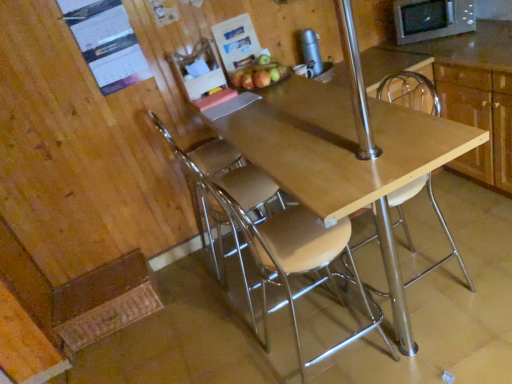
Locate an element on the screen. wooden cabinet at upper right is located at coordinates (477, 95).

How much space does metallic silver chair at center, the first chair when ordered from left to right, occupy horizontally?

19.93 inches.

What do you see at coordinates (206, 175) in the screenshot? I see `metallic silver chair at center, the third chair from the right` at bounding box center [206, 175].

Locate an element on the screen. wooden seat at center, which appears as the 2th chair when viewed from the right is located at coordinates (269, 234).

Describe the element at coordinates (269, 234) in the screenshot. I see `wooden seat at center, which appears as the 2th chair when viewed from the right` at that location.

This screenshot has width=512, height=384. What do you see at coordinates (410, 92) in the screenshot?
I see `light brown wood chair at center, which appears as the 1th chair when viewed from the right` at bounding box center [410, 92].

The height and width of the screenshot is (384, 512). What do you see at coordinates (432, 19) in the screenshot? I see `metallic silver microwave at upper right` at bounding box center [432, 19].

You are a GUI agent. You are given a task and a screenshot of the screen. Output one action in this format:
    pyautogui.click(x=<x>, y=<y>)
    Task: Click on the wooden cabinet at upper right
    This screenshot has width=512, height=384.
    Given the screenshot: What is the action you would take?
    pyautogui.click(x=477, y=95)

Is metallic silver chair at center, the first chair when ordered from left to right, in contact with metallic silver microwave at upper right?

No, metallic silver chair at center, the first chair when ordered from left to right, is not in contact with metallic silver microwave at upper right.

Can you tell me how much metallic silver chair at center, the first chair when ordered from left to right, and metallic silver microwave at upper right differ in facing direction?

132 degrees.

Can you confirm if metallic silver chair at center, the first chair when ordered from left to right, is positioned to the left of metallic silver microwave at upper right?

Yes.

Between metallic silver chair at center, the third chair from the right, and metallic silver microwave at upper right, which one has less height?

metallic silver microwave at upper right is shorter.

How different are the orientations of metallic silver chair at center, the first chair when ordered from left to right, and wooden seat at center, which appears as the 2th chair when viewed from the right, in degrees?

1.55 degrees separate the facing orientations of metallic silver chair at center, the first chair when ordered from left to right, and wooden seat at center, which appears as the 2th chair when viewed from the right.

Is metallic silver chair at center, the third chair from the right, bigger or smaller than wooden seat at center, which appears as the 2th chair when viewed from the right?

Clearly, metallic silver chair at center, the third chair from the right, is larger in size than wooden seat at center, which appears as the 2th chair when viewed from the right.

Which object is further away from the camera taking this photo, metallic silver chair at center, the third chair from the right, or wooden seat at center, which appears as the 2th chair when viewed from the right?

metallic silver chair at center, the third chair from the right.

Which of these two, metallic silver chair at center, the third chair from the right, or wooden seat at center, which appears as the 2th chair when viewed from the right, stands taller?

wooden seat at center, which appears as the 2th chair when viewed from the right.

Which object is closer to the camera taking this photo, shiny red apple at upper center or wooden seat at center, which appears as the 2th chair when viewed from the right?

wooden seat at center, which appears as the 2th chair when viewed from the right, is closer to the camera.

Considering the positions of objects shiny red apple at upper center and wooden seat at center, which is the 2th chair from left to right, in the image provided, who is more to the left, shiny red apple at upper center or wooden seat at center, which is the 2th chair from left to right,?

shiny red apple at upper center is more to the left.

Is shiny red apple at upper center taller than wooden seat at center, which is the 2th chair from left to right?

No, shiny red apple at upper center is not taller than wooden seat at center, which is the 2th chair from left to right.

Could you tell me if shiny red apple at upper center is turned towards wooden seat at center, which is the 2th chair from left to right?

No.

From the image's perspective, is metallic silver microwave at upper right above or below metallic silver chair at center, the third chair from the right?

From the image's perspective, metallic silver microwave at upper right appears above metallic silver chair at center, the third chair from the right.

Considering the points (425, 10) and (158, 121), which point is behind, point (425, 10) or point (158, 121)?

The point (425, 10) is more distant.

Is metallic silver microwave at upper right in contact with metallic silver chair at center, the first chair when ordered from left to right?

metallic silver microwave at upper right is not next to metallic silver chair at center, the first chair when ordered from left to right, and they're not touching.

Could you tell me if metallic silver microwave at upper right is facing metallic silver chair at center, the third chair from the right?

No, metallic silver microwave at upper right is not oriented towards metallic silver chair at center, the third chair from the right.

Is wooden seat at center, which is the 2th chair from left to right, further to the viewer compared to metallic silver chair at center, the third chair from the right?

No, wooden seat at center, which is the 2th chair from left to right, is closer to the camera.

Considering the relative positions of wooden seat at center, which appears as the 2th chair when viewed from the right, and metallic silver chair at center, the third chair from the right, in the image provided, is wooden seat at center, which appears as the 2th chair when viewed from the right, to the right of metallic silver chair at center, the third chair from the right, from the viewer's perspective?

Yes, wooden seat at center, which appears as the 2th chair when viewed from the right, is to the right of metallic silver chair at center, the third chair from the right.

Consider the image. Is wooden seat at center, which is the 2th chair from left to right, not near metallic silver chair at center, the third chair from the right?

No, there isn't a large distance between wooden seat at center, which is the 2th chair from left to right, and metallic silver chair at center, the third chair from the right.

From the image's perspective, which is below, wooden seat at center, which is the 2th chair from left to right, or metallic silver chair at center, the third chair from the right?

wooden seat at center, which is the 2th chair from left to right.

From a real-world perspective, who is located higher, metallic silver thermos at upper center or light brown wood chair at center, acting as the 3th chair starting from the left?

metallic silver thermos at upper center, from a real-world perspective.

In the image, is metallic silver thermos at upper center on the left side or the right side of light brown wood chair at center, acting as the 3th chair starting from the left?

metallic silver thermos at upper center is positioned on light brown wood chair at center, acting as the 3th chair starting from the left,'s left side.

Is metallic silver thermos at upper center not within light brown wood chair at center, acting as the 3th chair starting from the left?

Yes.

The width and height of the screenshot is (512, 384). Identify the location of cabinetry below the metallic silver microwave at upper right (from a real-world perspective). (477, 95).

What's the angular difference between wooden cabinet at upper right and metallic silver microwave at upper right's facing directions?

The angular difference between wooden cabinet at upper right and metallic silver microwave at upper right is 48.4 degrees.

Is wooden cabinet at upper right not inside metallic silver microwave at upper right?

wooden cabinet at upper right lies outside metallic silver microwave at upper right's area.

Find the location of a particular element. The image size is (512, 384). the 3rd chair below the metallic silver microwave at upper right (from a real-world perspective) is located at coordinates (206, 175).

From a real-world perspective, which chair is the 1st one above the metallic silver chair at center, the first chair when ordered from left to right? Please provide its 2D coordinates.

[(269, 234)]

From the image, which object appears to be farther from light brown wood chair at center, acting as the 3th chair starting from the left, wooden cabinet at upper right or wooden seat at center, which appears as the 2th chair when viewed from the right?

Based on the image, wooden seat at center, which appears as the 2th chair when viewed from the right, appears to be further to light brown wood chair at center, acting as the 3th chair starting from the left.

Which object lies nearer to the anchor point metallic silver thermos at upper center, metallic silver chair at center, the first chair when ordered from left to right, or light brown wood chair at center, acting as the 3th chair starting from the left?

light brown wood chair at center, acting as the 3th chair starting from the left, is positioned closer to the anchor metallic silver thermos at upper center.

Estimate the real-world distances between objects in this image. Which object is closer to metallic silver chair at center, the first chair when ordered from left to right, wooden cabinet at upper right or metallic silver thermos at upper center?

The object closer to metallic silver chair at center, the first chair when ordered from left to right, is metallic silver thermos at upper center.

Based on their spatial positions, is shiny red apple at upper center or metallic silver thermos at upper center closer to wooden cabinet at upper right?

metallic silver thermos at upper center is positioned closer to the anchor wooden cabinet at upper right.

Estimate the real-world distances between objects in this image. Which object is closer to metallic silver chair at center, the third chair from the right, wooden seat at center, which is the 2th chair from left to right, or wooden cabinet at upper right?

Based on the image, wooden seat at center, which is the 2th chair from left to right, appears to be nearer to metallic silver chair at center, the third chair from the right.

When comparing their distances from shiny red apple at upper center, does light brown wood chair at center, which appears as the 1th chair when viewed from the right, or metallic silver chair at center, the first chair when ordered from left to right, seem closer?

Among the two, metallic silver chair at center, the first chair when ordered from left to right, is located nearer to shiny red apple at upper center.

Considering their positions, is light brown wood chair at center, acting as the 3th chair starting from the left, positioned further to wooden cabinet at upper right than shiny red apple at upper center?

The object further to wooden cabinet at upper right is shiny red apple at upper center.

From the image, which object appears to be farther from light brown wood chair at center, acting as the 3th chair starting from the left, wooden cabinet at upper right or metallic silver thermos at upper center?

metallic silver thermos at upper center.

At what (x,y) coordinates should I click in order to perform the action: click on appliance between metallic silver chair at center, the first chair when ordered from left to right, and wooden cabinet at upper right from left to right. Please return your answer as a coordinate pair (x, y). The image size is (512, 384). Looking at the image, I should click on (311, 52).

I want to click on cabinetry between metallic silver microwave at upper right and wooden seat at center, which appears as the 2th chair when viewed from the right, in the vertical direction, so click(477, 95).

I want to click on chair located between wooden seat at center, which appears as the 2th chair when viewed from the right, and metallic silver chair at center, the third chair from the right, in the depth direction, so click(410, 92).

Where is `apple between metallic silver chair at center, the first chair when ordered from left to right, and wooden cabinet at upper right, in the horizontal direction`? The width and height of the screenshot is (512, 384). apple between metallic silver chair at center, the first chair when ordered from left to right, and wooden cabinet at upper right, in the horizontal direction is located at coordinates (x=259, y=73).